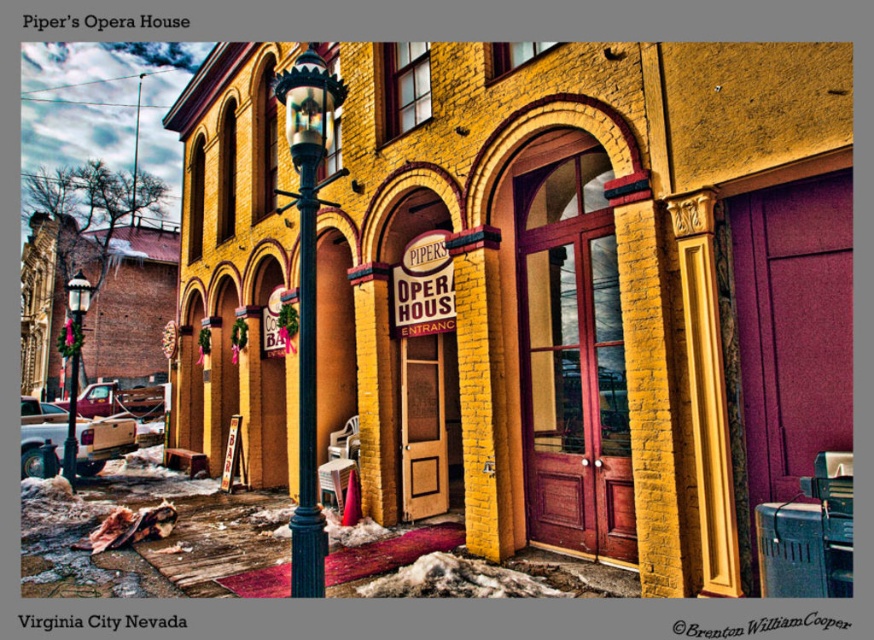
Can you confirm if green painted metal pole at center is bigger than metallic streetlamp at center-left?

Actually, green painted metal pole at center might be smaller than metallic streetlamp at center-left.

Does green painted metal pole at center appear over metallic streetlamp at center-left?

Indeed, green painted metal pole at center is positioned over metallic streetlamp at center-left.

The height and width of the screenshot is (640, 874). In order to click on green painted metal pole at center in this screenshot , I will do `click(306, 397)`.

Which of these two, yellow brick building at center or green painted metal pole at center, stands taller?

With more height is yellow brick building at center.

Looking at this image, can you confirm if yellow brick building at center is positioned above green painted metal pole at center?

Indeed, yellow brick building at center is positioned over green painted metal pole at center.

Locate an element on the screen. This screenshot has width=874, height=640. yellow brick building at center is located at coordinates (588, 289).

Is point (567, 355) positioned behind point (290, 545)?

Yes, point (567, 355) is behind point (290, 545).

Between yellow brick building at center and green painted metal streetlamp at center, which one appears on the right side from the viewer's perspective?

Positioned to the right is green painted metal streetlamp at center.

Image resolution: width=874 pixels, height=640 pixels. In order to click on yellow brick building at center in this screenshot , I will do `click(588, 289)`.

Image resolution: width=874 pixels, height=640 pixels. I want to click on yellow brick building at center, so (x=588, y=289).